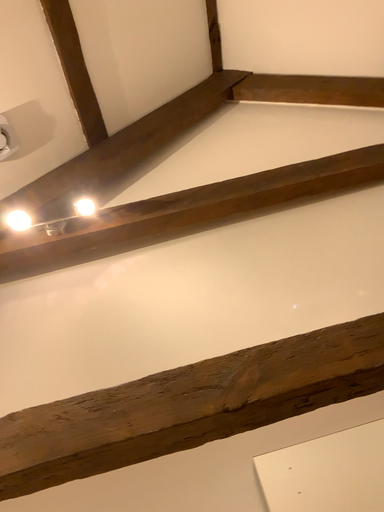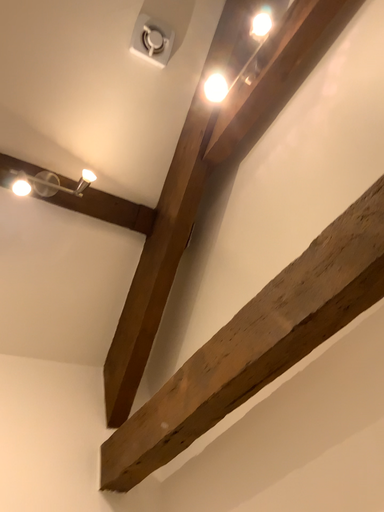
Question: How did the camera likely rotate when shooting the video?

Choices:
 (A) rotated downward
 (B) rotated upward

Answer: (A)